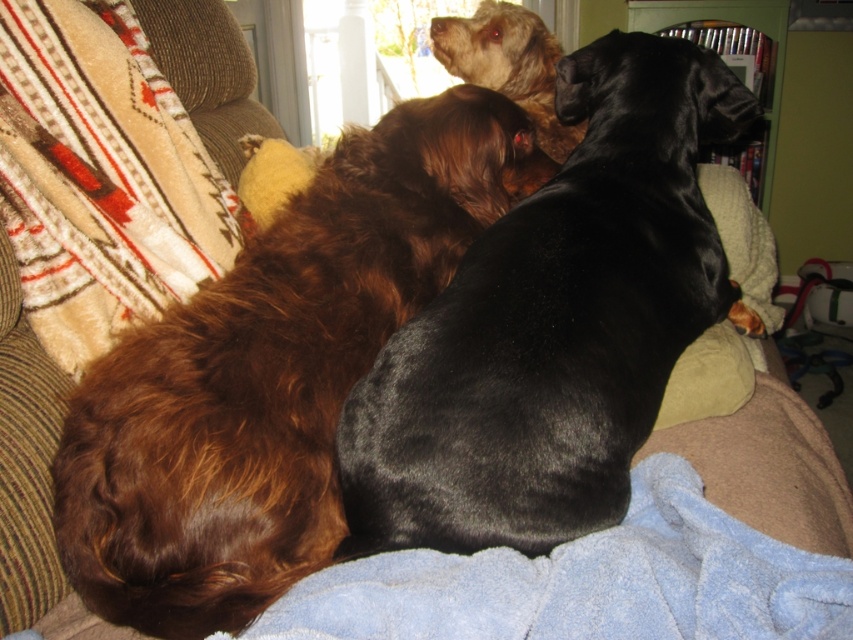
Consider the image. Can you confirm if shiny black dog at center is shorter than beige fuzzy blanket at left?

Incorrect, shiny black dog at center's height does not fall short of beige fuzzy blanket at left's.

What do you see at coordinates (554, 323) in the screenshot? The image size is (853, 640). I see `shiny black dog at center` at bounding box center [554, 323].

Find the location of a particular element. Image resolution: width=853 pixels, height=640 pixels. shiny black dog at center is located at coordinates (554, 323).

Does shiny black dog at center appear over blue fleece blanket at center?

Indeed, shiny black dog at center is positioned over blue fleece blanket at center.

Is point (502, 440) farther from viewer compared to point (553, 625)?

That is True.

Does point (405, 492) lie behind point (698, 600)?

Yes, it is.

Where is `shiny black dog at center`? The width and height of the screenshot is (853, 640). shiny black dog at center is located at coordinates (554, 323).

Is beige fuzzy blanket at left shorter than blue fleece blanket at center?

In fact, beige fuzzy blanket at left may be taller than blue fleece blanket at center.

Is point (47, 214) positioned after point (820, 589)?

Yes, it is.

Where is `beige fuzzy blanket at left`? beige fuzzy blanket at left is located at coordinates pyautogui.click(x=100, y=177).